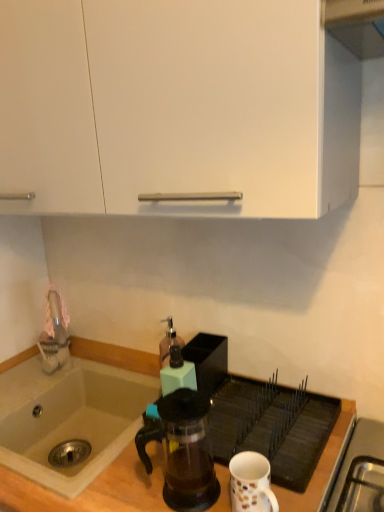
This screenshot has width=384, height=512. In order to click on vacant area that lies to the right of transparent glass coffee maker at center in this screenshot , I will do `click(269, 461)`.